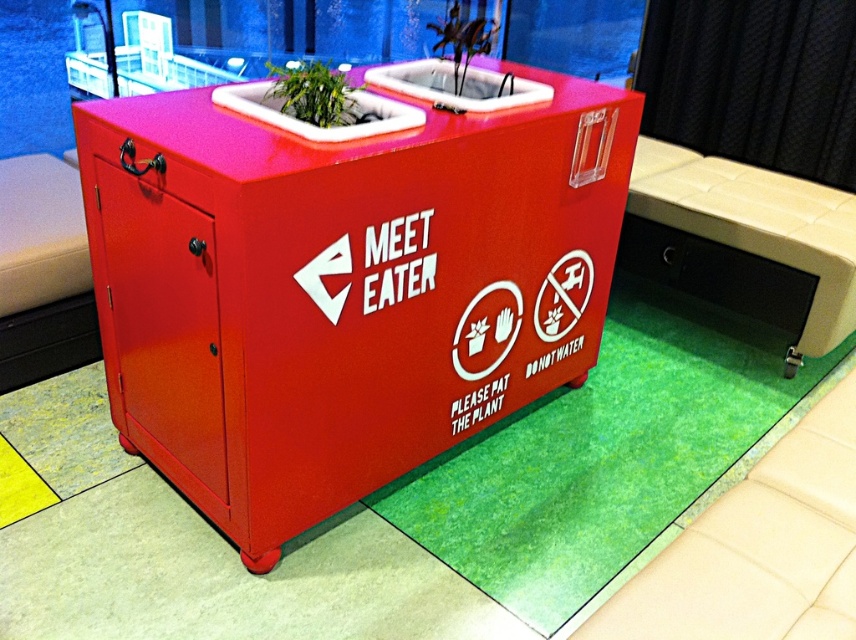
You are standing in front of the red container labeled MEET EATER. There are two points marked on the container at coordinates point (276, 88) and point (465, 65). If you want to touch the point that is closer to you, which coordinate should you aim for?

Point (276, 88) is closer to the viewer than point (465, 65), so you should aim for point (276, 88).